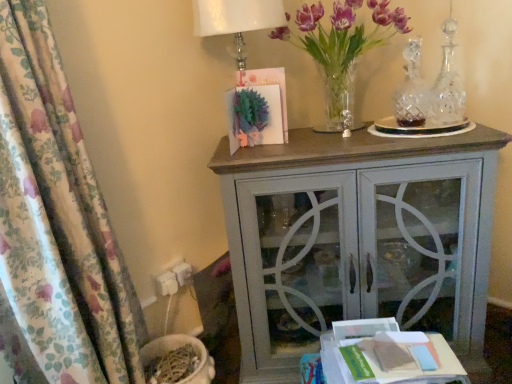
Question: From the image's perspective, is floral fabric curtain at left located beneath matte gray cabinet at center?

Choices:
 (A) no
 (B) yes

Answer: (A)

Question: Does floral fabric curtain at left have a larger size compared to matte gray cabinet at center?

Choices:
 (A) no
 (B) yes

Answer: (A)

Question: Is floral fabric curtain at left smaller than matte gray cabinet at center?

Choices:
 (A) no
 (B) yes

Answer: (B)

Question: Is floral fabric curtain at left facing towards matte gray cabinet at center?

Choices:
 (A) no
 (B) yes

Answer: (A)

Question: Considering the relative sizes of floral fabric curtain at left and matte gray cabinet at center in the image provided, is floral fabric curtain at left wider than matte gray cabinet at center?

Choices:
 (A) no
 (B) yes

Answer: (A)

Question: Considering their positions, is white paper at lower right located in front of or behind floral fabric curtain at left?

Choices:
 (A) behind
 (B) front

Answer: (A)

Question: From the image's perspective, relative to floral fabric curtain at left, is white paper at lower right above or below?

Choices:
 (A) below
 (B) above

Answer: (A)

Question: Considering the relative positions of white paper at lower right and floral fabric curtain at left in the image provided, is white paper at lower right to the left or to the right of floral fabric curtain at left?

Choices:
 (A) right
 (B) left

Answer: (A)

Question: Considering the positions of point (465, 377) and point (2, 3), is point (465, 377) closer or farther from the camera than point (2, 3)?

Choices:
 (A) closer
 (B) farther

Answer: (B)

Question: Considering the positions of purple glass vase at upper right and matte gray cabinet at center in the image, is purple glass vase at upper right wider or thinner than matte gray cabinet at center?

Choices:
 (A) wide
 (B) thin

Answer: (A)

Question: In terms of height, does purple glass vase at upper right look taller or shorter compared to matte gray cabinet at center?

Choices:
 (A) short
 (B) tall

Answer: (A)

Question: Is purple glass vase at upper right inside or outside of matte gray cabinet at center?

Choices:
 (A) outside
 (B) inside

Answer: (A)

Question: From a real-world perspective, relative to matte gray cabinet at center, is purple glass vase at upper right vertically above or below?

Choices:
 (A) below
 (B) above

Answer: (B)

Question: Considering the positions of matte gray cabinet at center and white paper at lower right in the image, is matte gray cabinet at center bigger or smaller than white paper at lower right?

Choices:
 (A) big
 (B) small

Answer: (A)

Question: Is matte gray cabinet at center in front of or behind white paper at lower right in the image?

Choices:
 (A) front
 (B) behind

Answer: (B)